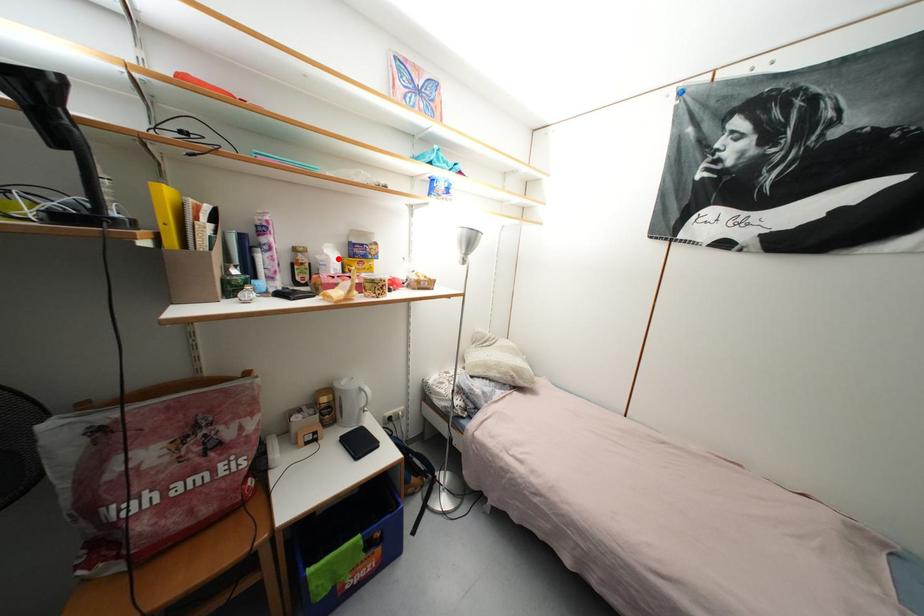
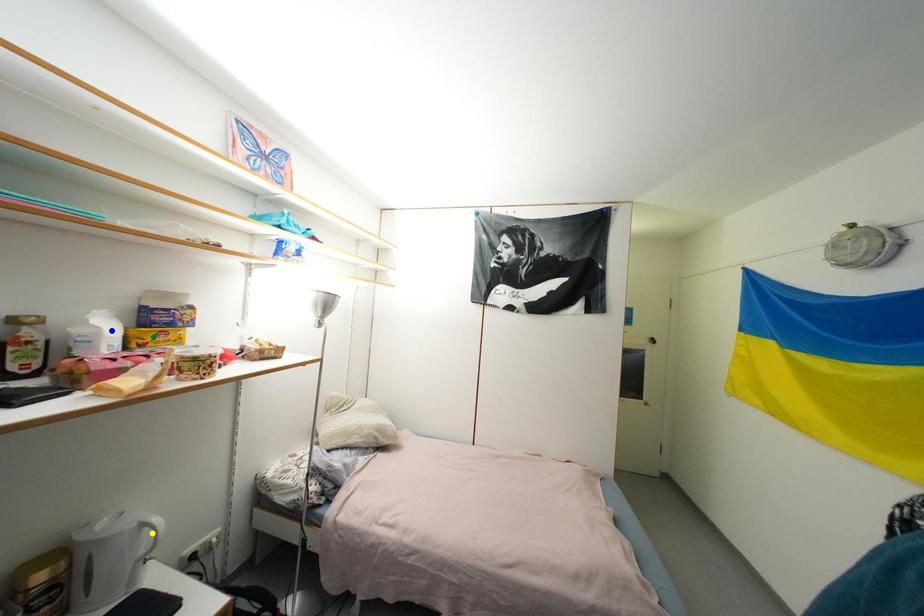
Question: I am providing you with two images of the same scene from different viewpoints. A red point is marked on the first image. You are given multiple points on the second image. Which point in image 2 represents the same 3d spot as the red point in image 1?

Choices:
 (A) blue point
 (B) yellow point
 (C) green point

Answer: (A)